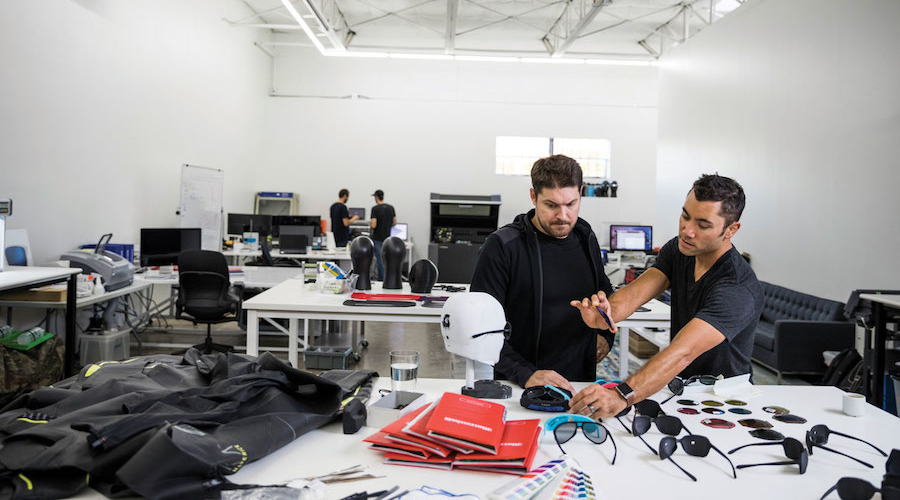
Find the location of a particular element. The width and height of the screenshot is (900, 500). windows is located at coordinates (518, 145), (586, 150).